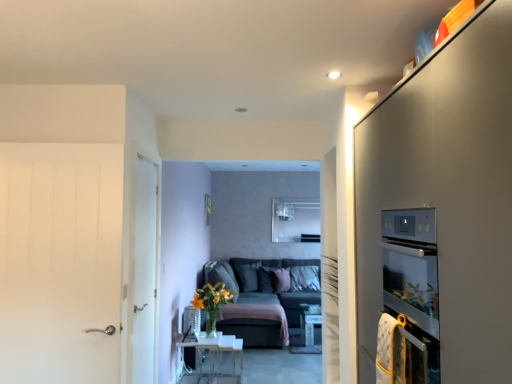
Question: Looking at their shapes, would you say pink fabric pillow at center, the 2th pillow in the right-to-left sequence, is wider or thinner than dark gray fabric couch at center?

Choices:
 (A) wide
 (B) thin

Answer: (B)

Question: Relative to dark gray fabric couch at center, is pink fabric pillow at center, which is the second pillow in left-to-right order, in front or behind?

Choices:
 (A) behind
 (B) front

Answer: (A)

Question: Which of these objects is positioned closest to the pink fabric pillow at center, the 2th pillow in the right-to-left sequence?

Choices:
 (A) velvet dark gray pillow at center, which appears as the first pillow when viewed from the left
 (B) dark gray fabric couch at center
 (C) clear glass table at lower center
 (D) white wood door at left, marked as the first door in a back-to-front arrangement
 (E) white matte door at left, positioned as the second door in right-to-left order

Answer: (A)

Question: Considering the real-world distances, which object is closest to the velvet dark gray pillow at center, which appears as the 3th pillow when viewed from the right?

Choices:
 (A) pink fabric pillow at center, the 2th pillow in the right-to-left sequence
 (B) satin white cabinet at right
 (C) white soft pillow at center, acting as the 1th pillow starting from the right
 (D) white matte door at left, positioned as the 1th door in front-to-back order
 (E) white wood door at left, marked as the first door in a back-to-front arrangement

Answer: (A)